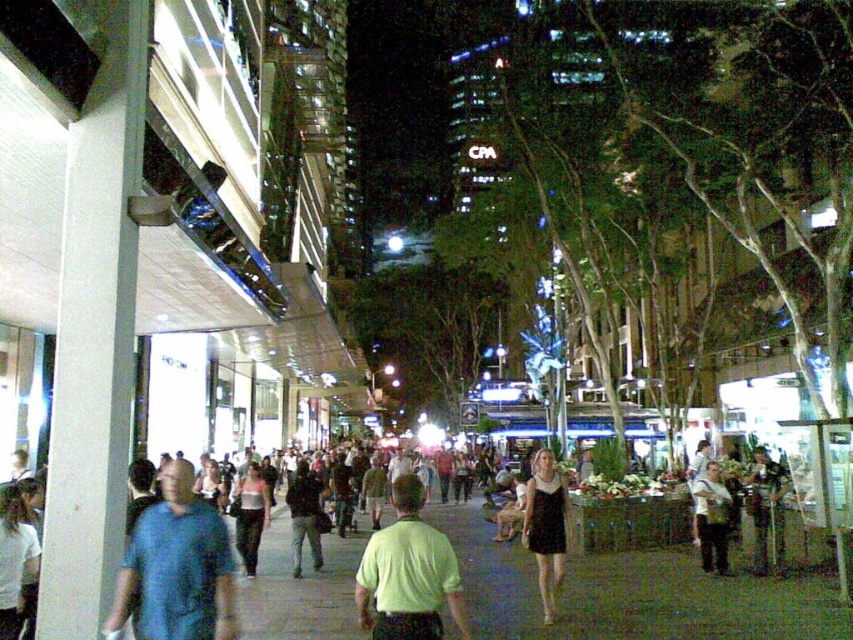
Question: Can you confirm if camouflage fabric jacket at center is positioned above light brown leather jacket at lower right?

Choices:
 (A) yes
 (B) no

Answer: (B)

Question: Is blue cotton shirt at center above light brown leather jacket at lower right?

Choices:
 (A) no
 (B) yes

Answer: (B)

Question: Which point is farther from the camera taking this photo?

Choices:
 (A) (572, 612)
 (B) (248, 472)
 (C) (723, 563)
 (D) (303, 476)

Answer: (B)

Question: Considering the real-world distances, which object is closest to the black dress at center?

Choices:
 (A) blue cotton shirt at center
 (B) camouflage fabric jacket at center
 (C) dark gray fabric jacket at center
 (D) light pink fabric dress at center

Answer: (C)

Question: Among these points, which one is farthest from the camera?

Choices:
 (A) (444, 588)
 (B) (112, 630)
 (C) (289, 506)
 (D) (619, 589)

Answer: (C)

Question: Is smooth concrete pavement at center above light green fabric shirt at center?

Choices:
 (A) no
 (B) yes

Answer: (A)